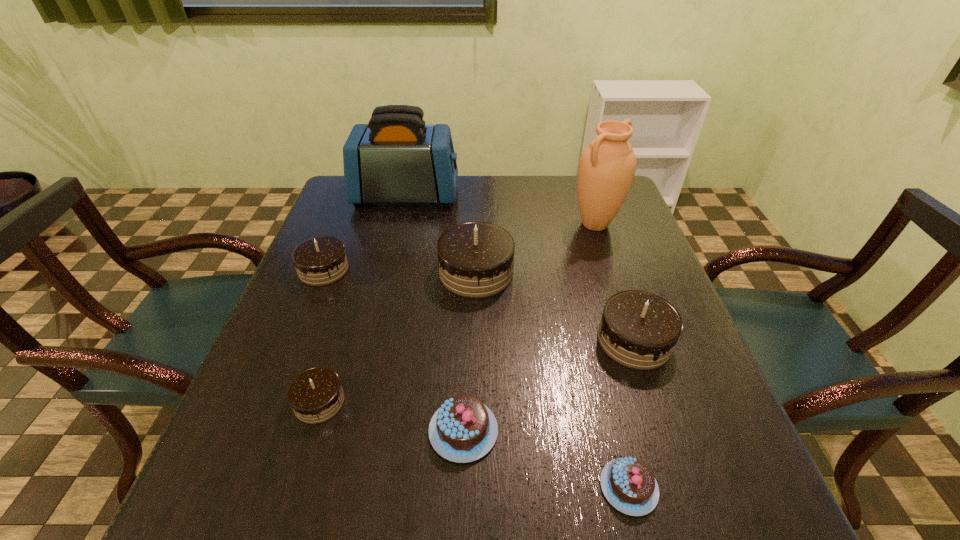
What are the coordinates of `vacant point that satisfies the following two spatial constraints: 1. on the front side of the fourth shortest chocolate cake; 2. on the left side of the shortest chocolate cake` in the screenshot? It's located at (236, 487).

This screenshot has width=960, height=540. Find the location of `vacant position in the image that satisfies the following two spatial constraints: 1. on the back side of the urn; 2. on the left side of the left pink chocolate cake`. vacant position in the image that satisfies the following two spatial constraints: 1. on the back side of the urn; 2. on the left side of the left pink chocolate cake is located at coordinates (x=469, y=224).